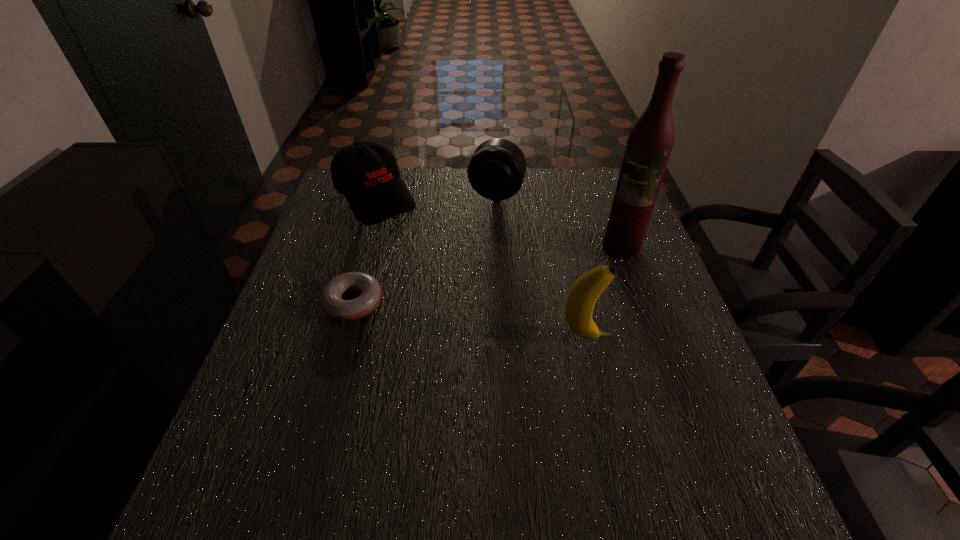
Where is `free point located on the front-facing side of the baseball cap`? This screenshot has height=540, width=960. free point located on the front-facing side of the baseball cap is located at coordinates (412, 242).

Locate an element on the screen. The image size is (960, 540). free region located on the front-facing side of the baseball cap is located at coordinates (405, 234).

At what (x,y) coordinates should I click in order to perform the action: click on vacant region located 0.220m on the front-facing side of the baseball cap. Please return your answer as a coordinate pair (x, y). Image resolution: width=960 pixels, height=540 pixels. Looking at the image, I should click on click(x=433, y=264).

Locate an element on the screen. The height and width of the screenshot is (540, 960). free spot located on the front-facing side of the third object from left to right is located at coordinates (487, 218).

The image size is (960, 540). In order to click on vacant space located on the front-facing side of the third object from left to right in this screenshot , I will do `click(468, 271)`.

Where is `free space located on the front-facing side of the third object from left to right`? This screenshot has width=960, height=540. free space located on the front-facing side of the third object from left to right is located at coordinates pyautogui.click(x=480, y=234).

What are the coordinates of `blank area located 0.270m on the label of the rightmost object` in the screenshot? It's located at pyautogui.click(x=529, y=296).

I want to click on vacant space located on the label of the rightmost object, so click(564, 278).

In order to click on free space located on the label of the rightmost object in this screenshot , I will do `click(519, 302)`.

Image resolution: width=960 pixels, height=540 pixels. I want to click on baseball cap that is positioned at the far edge, so click(367, 173).